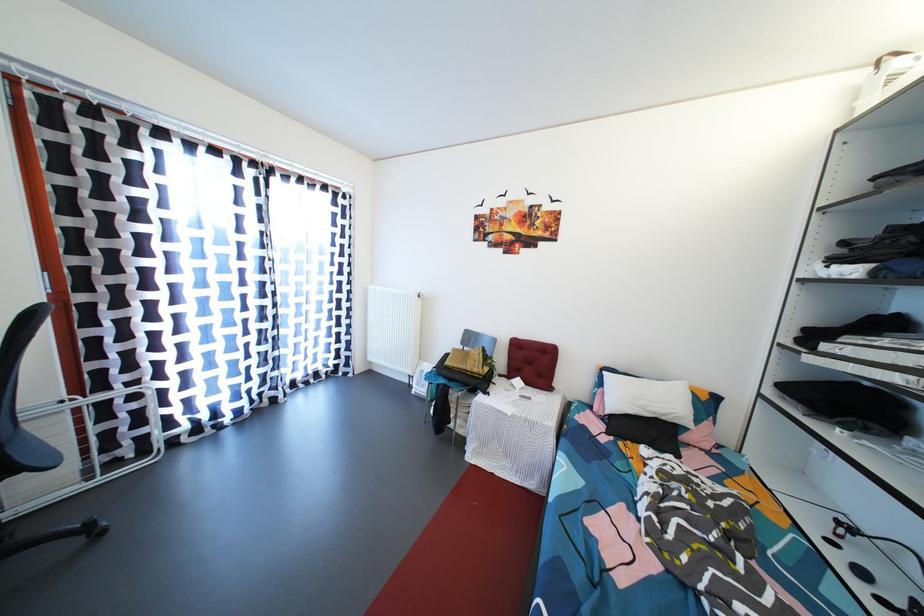
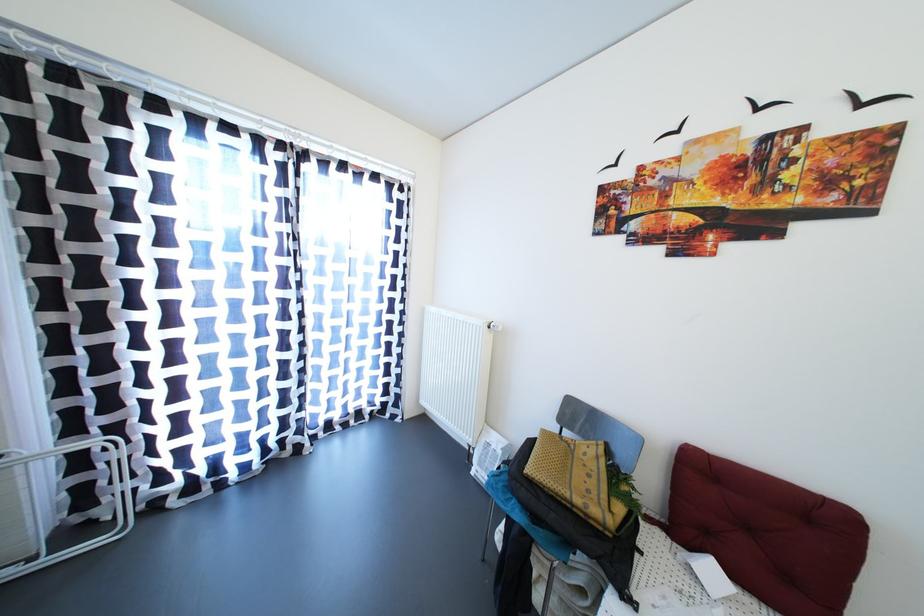
The point at (475, 373) is marked in the first image. Where is the corresponding point in the second image?

(584, 506)